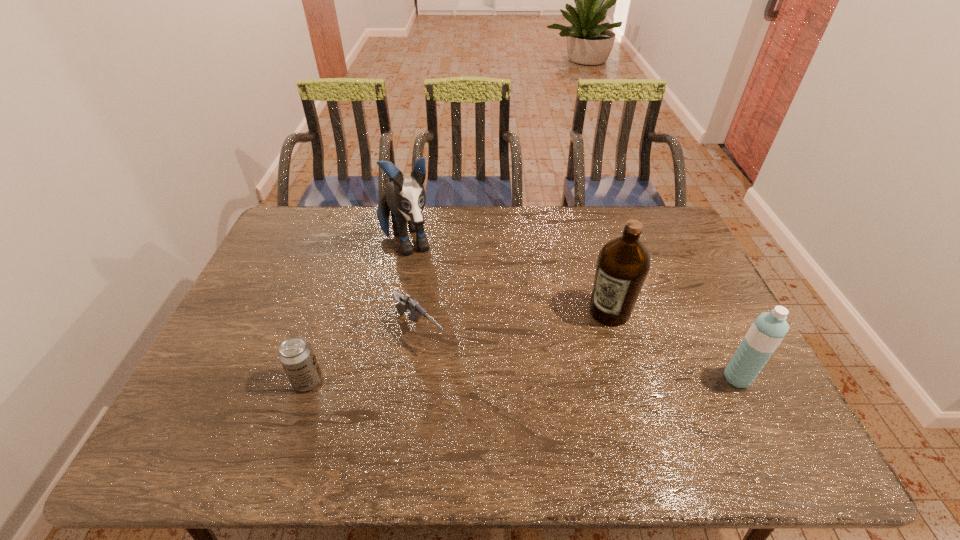
Find the location of `vacant spot on the desktop that is between the fourth tallest object and the water bottle and is positioned on the front-facing side of the puppy`. vacant spot on the desktop that is between the fourth tallest object and the water bottle and is positioned on the front-facing side of the puppy is located at coordinates (463, 380).

Where is `vacant space on the desktop that is between the second shortest object and the third shortest object and is positioned at the barrel of the gun`? The image size is (960, 540). vacant space on the desktop that is between the second shortest object and the third shortest object and is positioned at the barrel of the gun is located at coordinates (468, 380).

Where is `free space on the desktop that is between the leftmost object and the rightmost object and is positioned on the label of the fourth shortest object`? The width and height of the screenshot is (960, 540). free space on the desktop that is between the leftmost object and the rightmost object and is positioned on the label of the fourth shortest object is located at coordinates (552, 379).